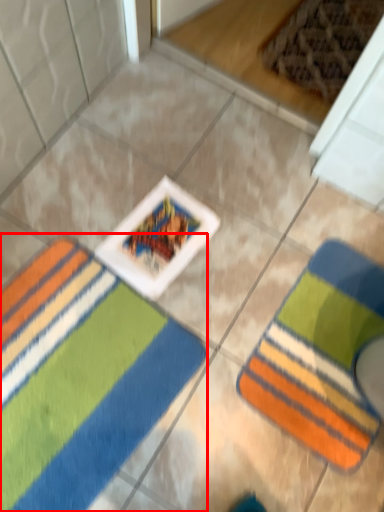
Question: From the image's perspective, considering the relative positions of towel (annotated by the red box) and towel in the image provided, where is towel (annotated by the red box) located with respect to the staircase?

Choices:
 (A) below
 (B) above

Answer: (A)